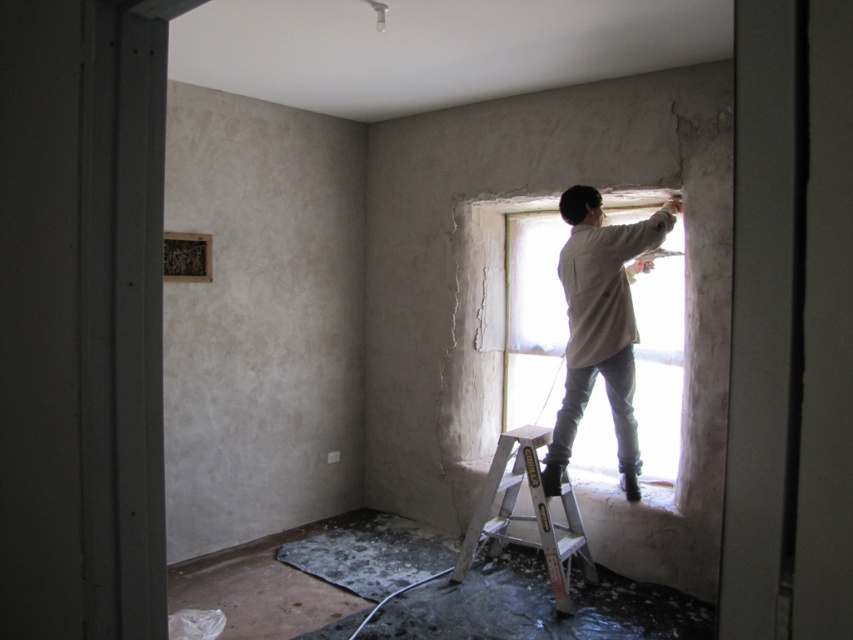
You are an inspector checking the renovation site. You need to locate the light brown cotton shirt at upper right. According to the coordinates provided, where exactly is it positioned in the image?

The light brown cotton shirt at upper right is located at point coordinates (601, 324).

You are an inspector checking the renovation site. You notice the light brown cotton shirt at upper right and the silver metallic ladder at center. Which object is taller in the image?

The light brown cotton shirt at upper right is taller than the silver metallic ladder at center according to the description.